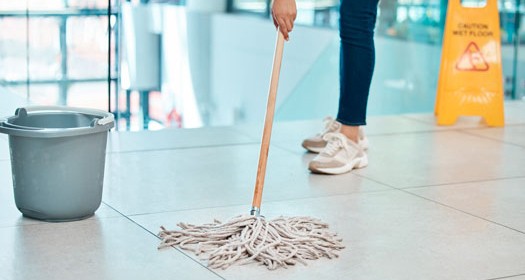
Where is `wet floor`? The image size is (525, 280). wet floor is located at coordinates (152, 198), (404, 236).